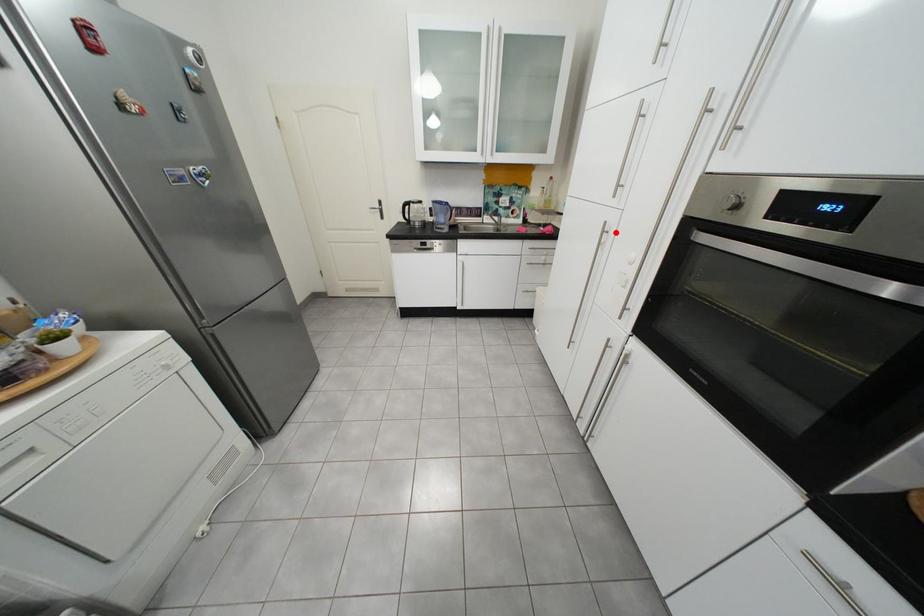
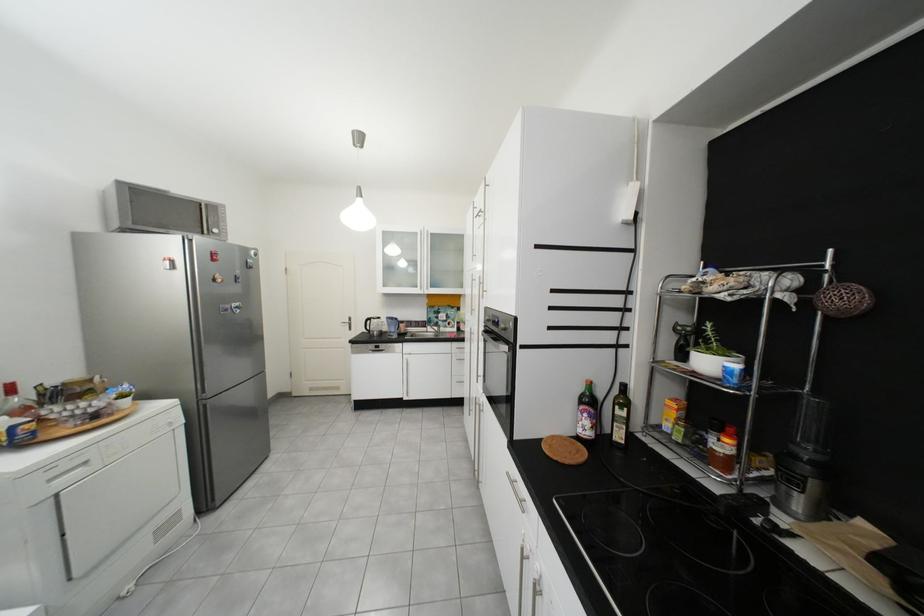
Where in the second image is the point corresponding to the highlighted location from the first image?

(482, 334)